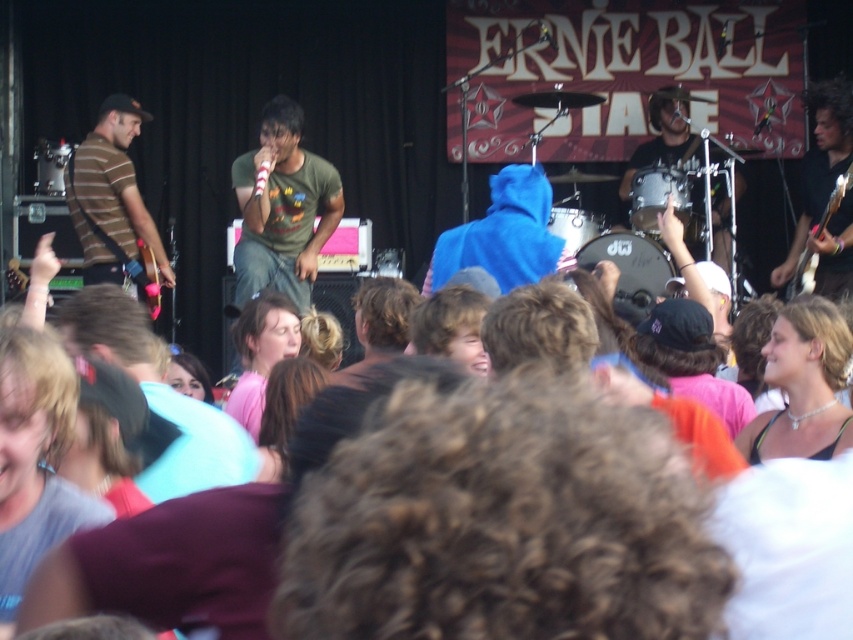
Question: Estimate the real-world distances between objects in this image. Which object is closer to the green matte t-shirt at center?

Choices:
 (A) striped jersey guitar at left
 (B) wooden electric guitar at right

Answer: (A)

Question: In this image, where is green matte t-shirt at center located relative to matte black drum set at right?

Choices:
 (A) above
 (B) below

Answer: (B)

Question: Considering the relative positions of pink fabric at center and matte black drum set at right in the image provided, where is pink fabric at center located with respect to matte black drum set at right?

Choices:
 (A) above
 (B) below

Answer: (B)

Question: Where is pink fabric at center located in relation to wooden electric guitar at right in the image?

Choices:
 (A) below
 (B) above

Answer: (A)

Question: Based on their relative distances, which object is farther from the pink fabric at center?

Choices:
 (A) green matte t-shirt at center
 (B) matte black drum set at right

Answer: (B)

Question: Based on their relative distances, which object is farther from the green matte t-shirt at center?

Choices:
 (A) pearl necklace at center
 (B) wooden electric guitar at right
 (C) matte black drum set at right

Answer: (A)